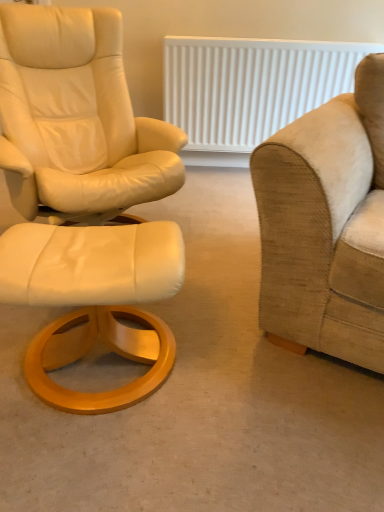
Question: Can you confirm if matte white ottoman at left is wider than white leather ottoman at left?

Choices:
 (A) yes
 (B) no

Answer: (A)

Question: Can you confirm if matte white ottoman at left is bigger than white leather ottoman at left?

Choices:
 (A) no
 (B) yes

Answer: (B)

Question: Is matte white ottoman at left further to camera compared to white leather ottoman at left?

Choices:
 (A) yes
 (B) no

Answer: (B)

Question: From a real-world perspective, is matte white ottoman at left beneath white leather ottoman at left?

Choices:
 (A) yes
 (B) no

Answer: (A)

Question: Does matte white ottoman at left have a lesser height compared to white leather ottoman at left?

Choices:
 (A) no
 (B) yes

Answer: (B)

Question: Would you say white leather ottoman at left is to the left or to the right of white textured radiator at upper center in the picture?

Choices:
 (A) left
 (B) right

Answer: (A)

Question: Is point (96, 302) positioned closer to the camera than point (168, 111)?

Choices:
 (A) closer
 (B) farther

Answer: (A)

Question: Looking at their shapes, would you say white leather ottoman at left is wider or thinner than white textured radiator at upper center?

Choices:
 (A) wide
 (B) thin

Answer: (A)

Question: Based on their sizes in the image, would you say white leather ottoman at left is bigger or smaller than white textured radiator at upper center?

Choices:
 (A) big
 (B) small

Answer: (B)

Question: From a real-world perspective, is beige fabric couch at right above or below white textured radiator at upper center?

Choices:
 (A) below
 (B) above

Answer: (B)

Question: Is point (291, 254) positioned closer to the camera than point (233, 146)?

Choices:
 (A) farther
 (B) closer

Answer: (B)

Question: In terms of size, does beige fabric couch at right appear bigger or smaller than white textured radiator at upper center?

Choices:
 (A) big
 (B) small

Answer: (A)

Question: Would you say beige fabric couch at right is to the left or to the right of white textured radiator at upper center in the picture?

Choices:
 (A) right
 (B) left

Answer: (A)

Question: Is white textured radiator at upper center to the left or to the right of white leather ottoman at left in the image?

Choices:
 (A) left
 (B) right

Answer: (B)

Question: From a real-world perspective, relative to white leather ottoman at left, is white textured radiator at upper center vertically above or below?

Choices:
 (A) above
 (B) below

Answer: (A)